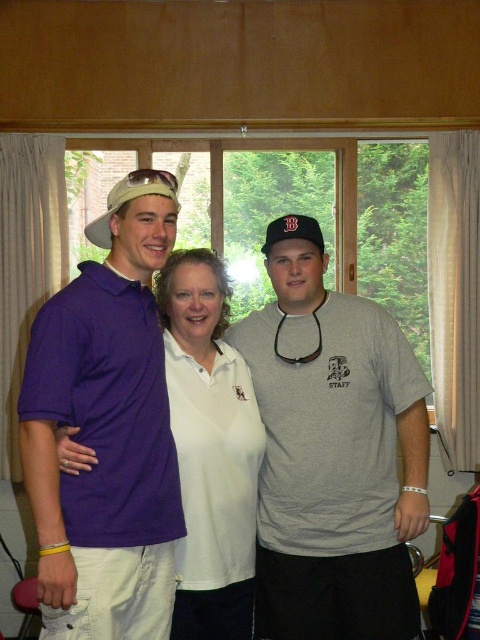
Does gray matte t-shirt at center appear on the right side of black fabric baseball cap at center?

Yes, gray matte t-shirt at center is to the right of black fabric baseball cap at center.

Is point (412, 472) in front of point (268, 228)?

Yes.

Is point (411, 435) positioned after point (295, 230)?

That is False.

Where is `gray matte t-shirt at center`? This screenshot has height=640, width=480. gray matte t-shirt at center is located at coordinates (334, 458).

Which is more to the left, white smooth shirt at center or beige fabric baseball cap at center?

From the viewer's perspective, beige fabric baseball cap at center appears more on the left side.

Is white smooth shirt at center further to camera compared to beige fabric baseball cap at center?

Yes, it is behind beige fabric baseball cap at center.

Is point (175, 637) less distant than point (153, 180)?

No.

The height and width of the screenshot is (640, 480). Identify the location of white smooth shirt at center. (211, 449).

Between purple matte polo shirt at left and black fabric baseball cap at center, which one has more height?

purple matte polo shirt at left is taller.

Does point (72, 582) come closer to viewer compared to point (298, 234)?

Yes, point (72, 582) is closer to viewer.

Who is more distant from viewer, (176, 516) or (315, 234)?

The point (315, 234) is more distant.

Find the location of a particular element. purple matte polo shirt at left is located at coordinates (106, 429).